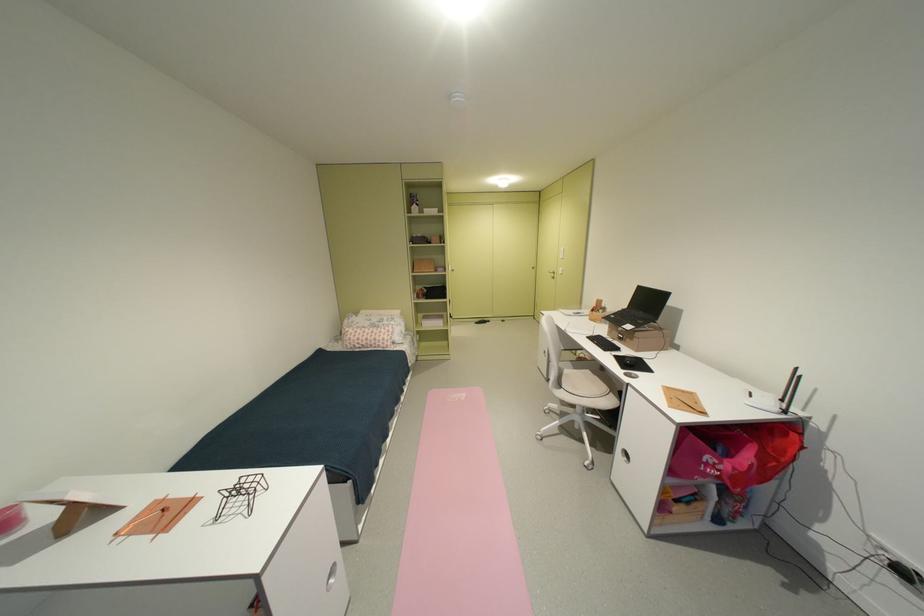
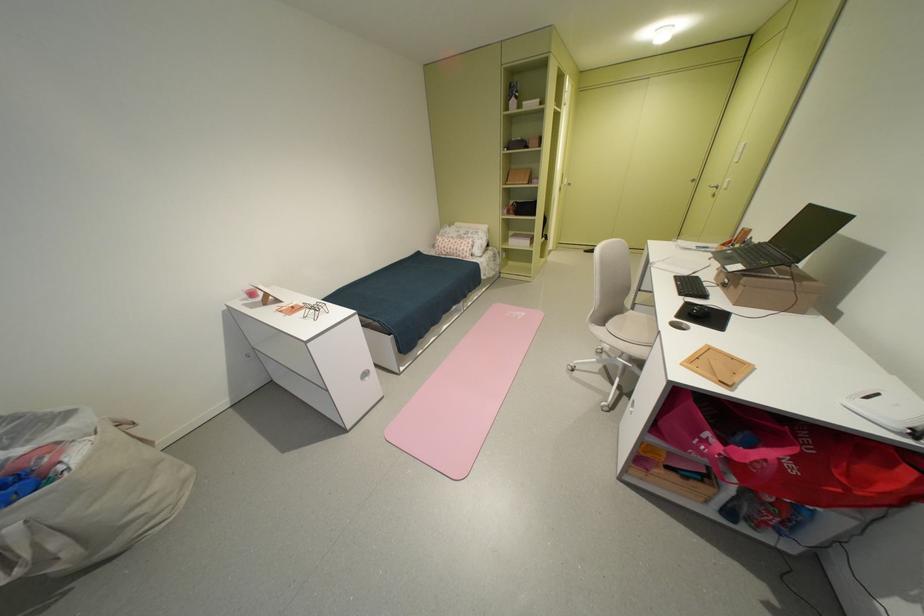
The point at (573, 387) is marked in the first image. Where is the corresponding point in the second image?

(615, 326)